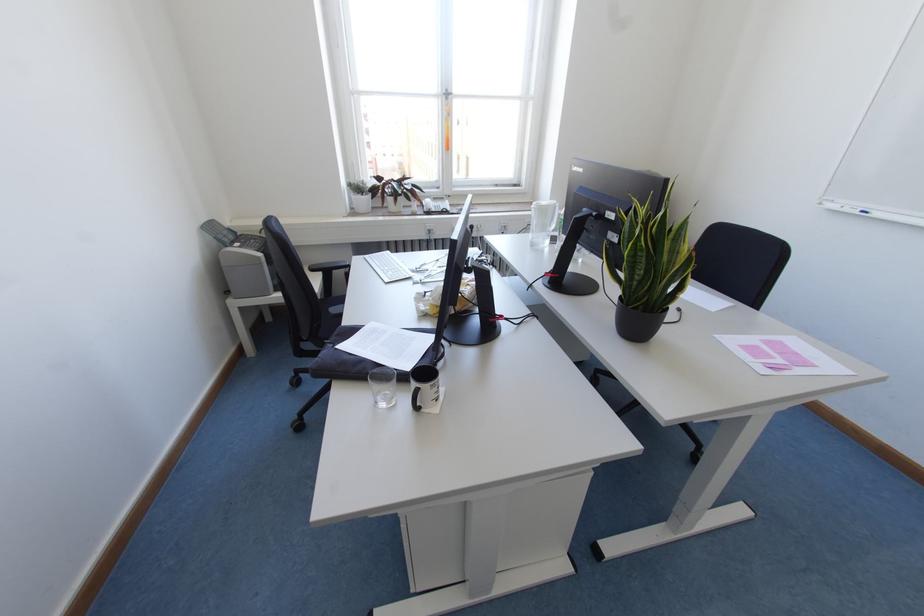
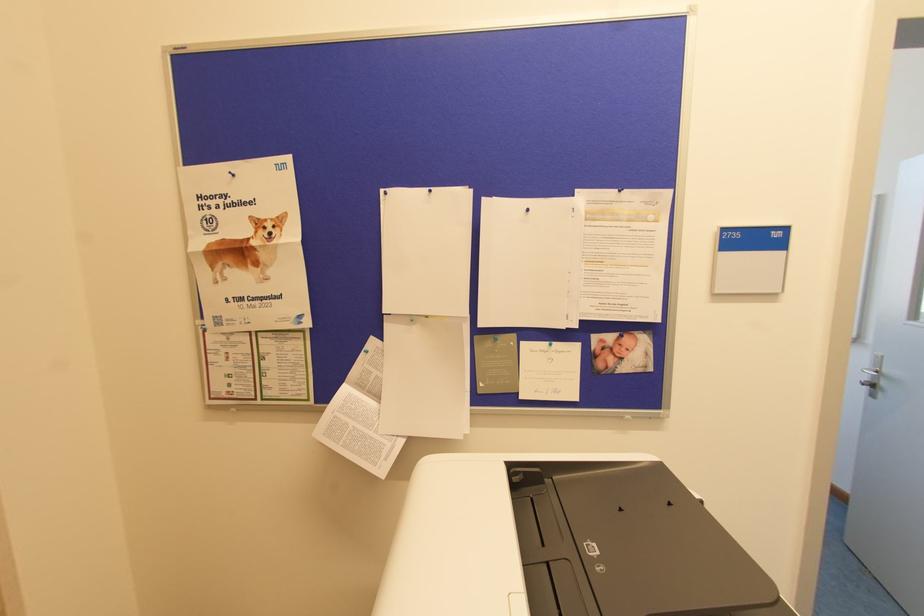
Question: The images are taken continuously from a first-person perspective. In which direction are you moving?

Choices:
 (A) Left
 (B) Right
 (C) Forward
 (D) Backward

Answer: (D)